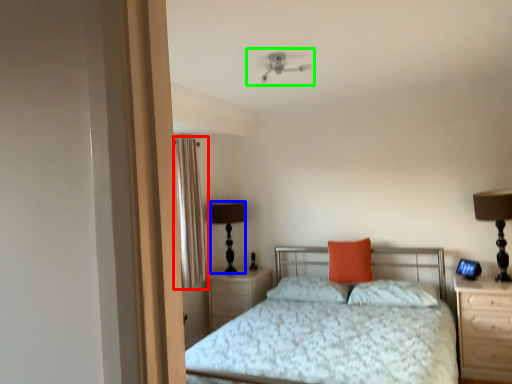
Question: Which object is positioned farthest from curtain (highlighted by a red box)? Select from table lamp (highlighted by a blue box) and mechanical fan (highlighted by a green box).

Choices:
 (A) table lamp
 (B) mechanical fan

Answer: (B)